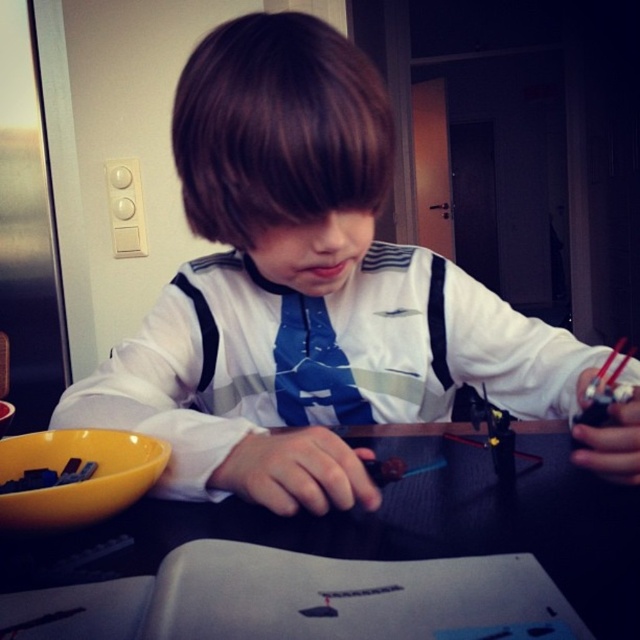
Does white matte shirt at center appear over black plastic table at center?

Indeed, white matte shirt at center is positioned over black plastic table at center.

Is white matte shirt at center below black plastic table at center?

No.

Describe the element at coordinates (304, 284) in the screenshot. I see `white matte shirt at center` at that location.

At what (x,y) coordinates should I click in order to perform the action: click on white matte shirt at center. Please return your answer as a coordinate pair (x, y). Looking at the image, I should click on [x=304, y=284].

In the scene shown: Is white matte shirt at center to the left of blue fabric tie at center from the viewer's perspective?

In fact, white matte shirt at center is to the right of blue fabric tie at center.

Describe the element at coordinates (304, 284) in the screenshot. I see `white matte shirt at center` at that location.

In order to click on white matte shirt at center in this screenshot , I will do `click(304, 284)`.

Does black plastic table at center have a greater height compared to blue fabric tie at center?

No.

Is black plastic table at center further to the viewer compared to blue fabric tie at center?

No, it is in front of blue fabric tie at center.

Between point (627, 560) and point (353, 394), which one is positioned behind?

The point (353, 394) is behind.

The image size is (640, 640). What are the coordinates of `black plastic table at center` in the screenshot? It's located at (397, 522).